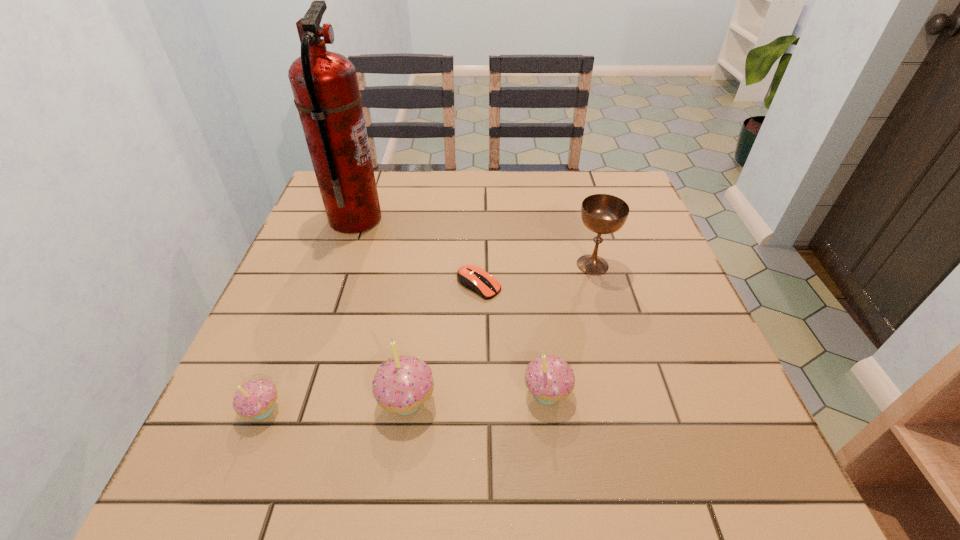
Identify the location of unoccupied area between the computer mouse and the shortest cupcake. (371, 347).

Find the location of a particular element. The width and height of the screenshot is (960, 540). vacant space that's between the rightmost object and the shortest cupcake is located at coordinates (427, 338).

I want to click on vacant space that's between the tallest cupcake and the shortest cupcake, so click(x=334, y=406).

Where is `empty space between the fifth tallest object and the farthest object`? This screenshot has height=540, width=960. empty space between the fifth tallest object and the farthest object is located at coordinates (309, 315).

The image size is (960, 540). I want to click on vacant area that lies between the second cupcake from right to left and the tallest object, so click(381, 310).

Identify the location of free space between the tallest object and the computer mouse. This screenshot has width=960, height=540. (417, 252).

Locate which object ranks in proximity to the leftmost cupcake. Please provide its 2D coordinates. Your answer should be formatted as a tuple, i.e. [(x, y)], where the tuple contains the x and y coordinates of a point satisfying the conditions above.

[(401, 385)]

Identify which object is the closest to the fifth tallest object. Please provide its 2D coordinates. Your answer should be formatted as a tuple, i.e. [(x, y)], where the tuple contains the x and y coordinates of a point satisfying the conditions above.

[(401, 385)]

Identify which cupcake is the third closest to the rightmost object. Please provide its 2D coordinates. Your answer should be formatted as a tuple, i.e. [(x, y)], where the tuple contains the x and y coordinates of a point satisfying the conditions above.

[(255, 399)]

Identify which cupcake is the closest to the rightmost cupcake. Please provide its 2D coordinates. Your answer should be formatted as a tuple, i.e. [(x, y)], where the tuple contains the x and y coordinates of a point satisfying the conditions above.

[(401, 385)]